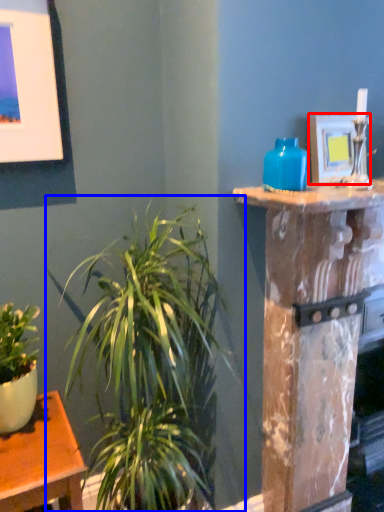
Question: Which of the following is the closest to the observer, picture frame (highlighted by a red box) or houseplant (highlighted by a blue box)?

Choices:
 (A) picture frame
 (B) houseplant

Answer: (B)